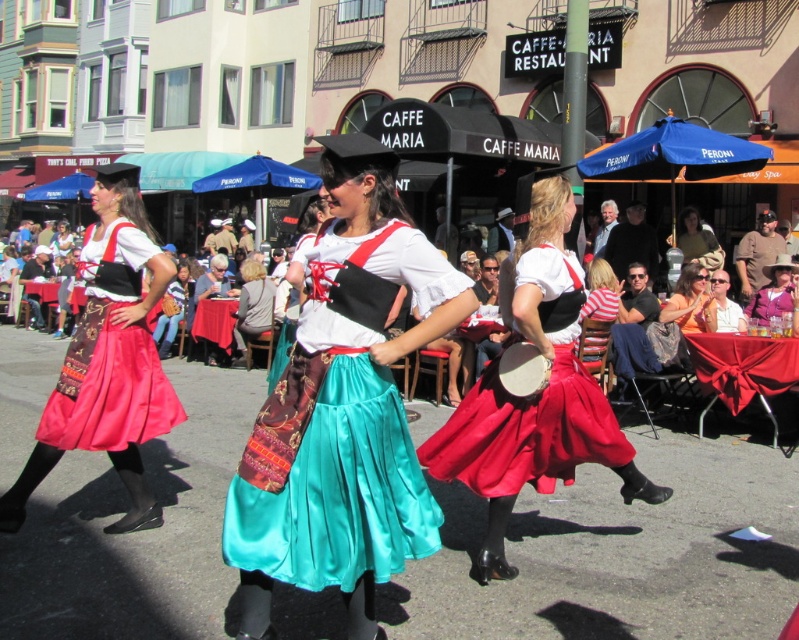
Question: Among these points, which one is farthest from the camera?

Choices:
 (A) pyautogui.click(x=350, y=419)
 (B) pyautogui.click(x=519, y=477)

Answer: (B)

Question: Does matte black drum at center come in front of orange fabric dress at center?

Choices:
 (A) yes
 (B) no

Answer: (A)

Question: Is matte brown leather purse at center below brown leather jacket at center?

Choices:
 (A) no
 (B) yes

Answer: (B)

Question: Among these points, which one is nearest to the camera?

Choices:
 (A) (118, 458)
 (B) (601, 250)
 (C) (766, 266)
 (D) (507, 438)

Answer: (D)

Question: Which object is closer to the camera taking this photo?

Choices:
 (A) matte brown leather purse at center
 (B) matte black hat at upper center

Answer: (B)

Question: Does satin skirt at center appear on the left side of brown leather jacket at center?

Choices:
 (A) yes
 (B) no

Answer: (A)